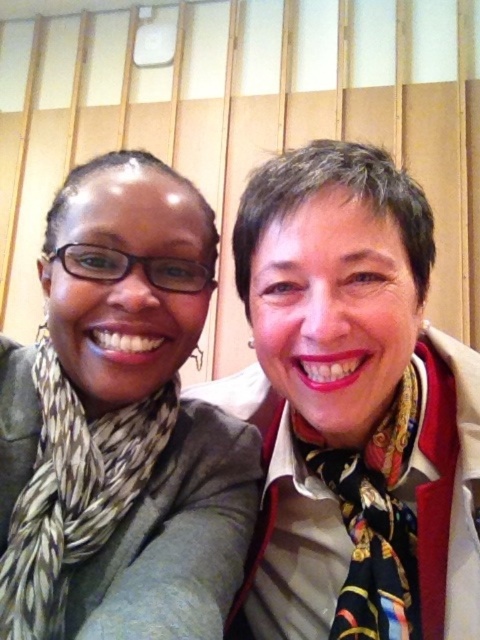
You are a photographer trying to adjust the spacing between the printed silk scarf at left and the multicolored silk scarf at center for a better composition. The recommended minimum distance between two subjects in a portrait is 10 inches. Can you determine if the current spacing between them is sufficient?

The distance between the printed silk scarf at left and the multicolored silk scarf at center is 9.42 inches, which is less than the recommended 10 inches. Therefore, the spacing is insufficient and needs adjustment.

You are a photographer setting up for a group photo. You notice two silk scarves in the frame. The printed silk scarf at left and the multicolored silk scarf at center. Which scarf is taller?

The printed silk scarf at left has a greater height compared to the multicolored silk scarf at center.

You are taking a photo of two people standing in front of a wooden slatted wall. You notice a printed silk scarf at left. Where should you position your camera to ensure the scarf is centered in the frame?

To center the printed silk scarf at left in the frame, position your camera at the point corresponding to its 2D location at approximately 0.773 on the x and 0.154 on the y coordinates.